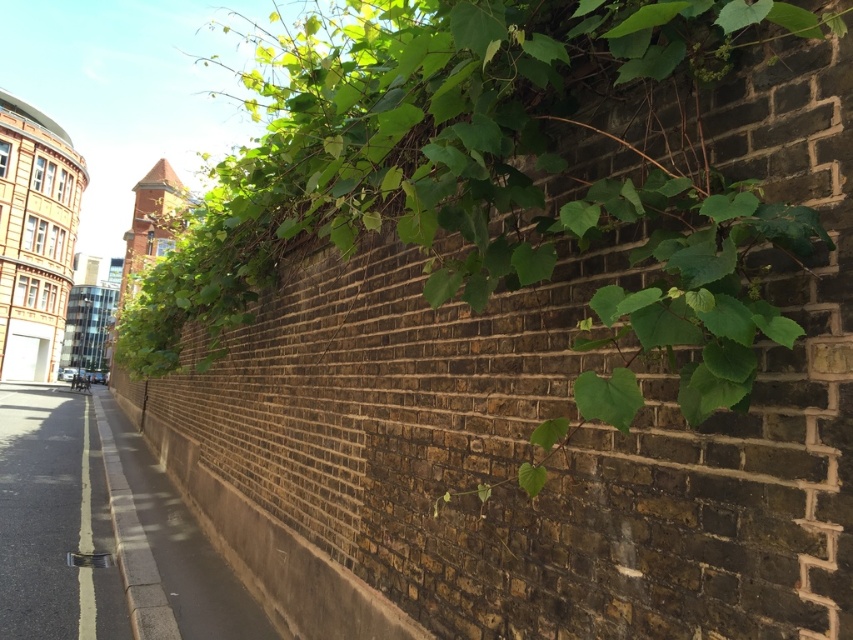
Question: Is green leafy plant at upper center to the right of gray concrete sidewalk at lower left from the viewer's perspective?

Choices:
 (A) yes
 (B) no

Answer: (A)

Question: Which of the following is the closest to the observer?

Choices:
 (A) (142, 502)
 (B) (28, 627)
 (C) (757, 193)

Answer: (C)

Question: Which point is farther to the camera?

Choices:
 (A) (212, 609)
 (B) (140, 317)
 (C) (62, 397)

Answer: (C)

Question: Does green leafy plant at upper center appear on the right side of black asphalt at lower left?

Choices:
 (A) no
 (B) yes

Answer: (B)

Question: Is black asphalt at lower left behind gray concrete sidewalk at lower left?

Choices:
 (A) no
 (B) yes

Answer: (B)

Question: Which point is closer to the camera taking this photo?

Choices:
 (A) (527, 4)
 (B) (194, 528)
 (C) (44, 483)

Answer: (A)